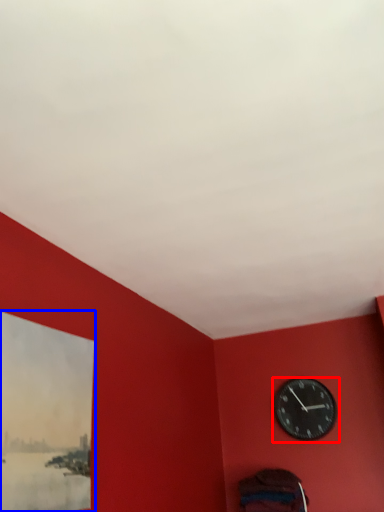
Question: Which object is closer to the camera taking this photo, wall clock (highlighted by a red box) or picture frame (highlighted by a blue box)?

Choices:
 (A) wall clock
 (B) picture frame

Answer: (B)